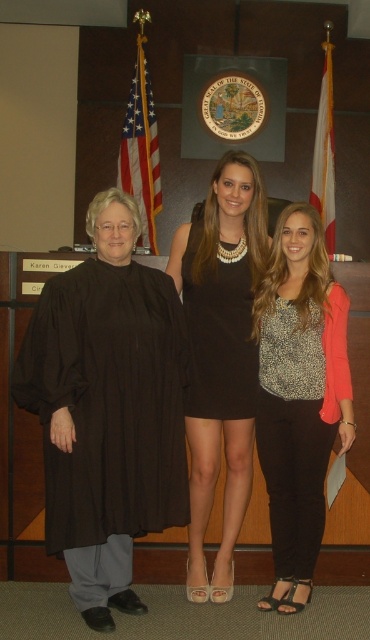
Does black dress at center come behind black satin dress at center?

Yes, it is.

Who is positioned more to the right, black dress at center or black satin dress at center?

From the viewer's perspective, black satin dress at center appears more on the right side.

Is point (239, 365) less distant than point (213, 326)?

Yes, it is in front of point (213, 326).

Where is `black dress at center`? This screenshot has width=370, height=640. black dress at center is located at coordinates (220, 355).

Is point (314, 445) closer to camera compared to point (194, 228)?

Yes, point (314, 445) is closer to viewer.

Who is taller, leopard print blouse at center or black satin dress at center?

Standing taller between the two is leopard print blouse at center.

Where is `leopard print blouse at center`? leopard print blouse at center is located at coordinates (300, 396).

This screenshot has width=370, height=640. In order to click on black matte robe at left in this screenshot , I will do `click(106, 410)`.

Does black matte robe at left have a smaller size compared to black dress at center?

No.

Looking at this image, who is more distant from viewer, (156, 276) or (243, 316)?

Point (243, 316)

Identify the location of black matte robe at left. This screenshot has width=370, height=640. (106, 410).